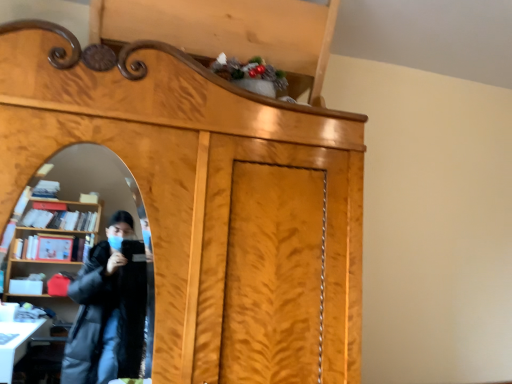
Where is `wooden cabinet at center`? The height and width of the screenshot is (384, 512). wooden cabinet at center is located at coordinates (204, 195).

The image size is (512, 384). Describe the element at coordinates (204, 195) in the screenshot. I see `wooden cabinet at center` at that location.

Image resolution: width=512 pixels, height=384 pixels. In order to click on wooden cabinet at center in this screenshot , I will do `click(204, 195)`.